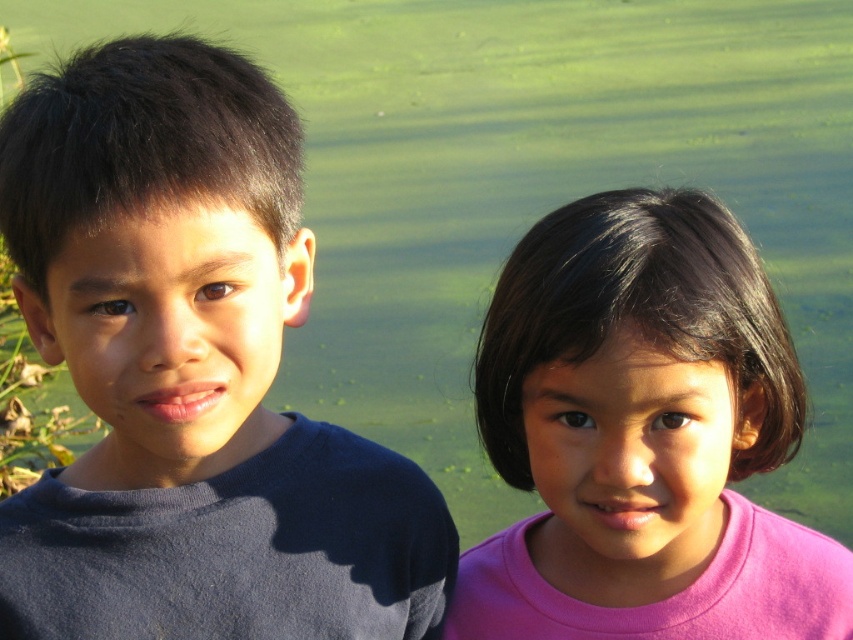
Is dark blue shirt at left to the right of pink matte shirt at right from the viewer's perspective?

In fact, dark blue shirt at left is to the left of pink matte shirt at right.

Between dark blue shirt at left and pink matte shirt at right, which one appears on the right side from the viewer's perspective?

Positioned to the right is pink matte shirt at right.

Locate an element on the screen. dark blue shirt at left is located at coordinates (190, 372).

Where is `dark blue shirt at left`? This screenshot has height=640, width=853. dark blue shirt at left is located at coordinates (190, 372).